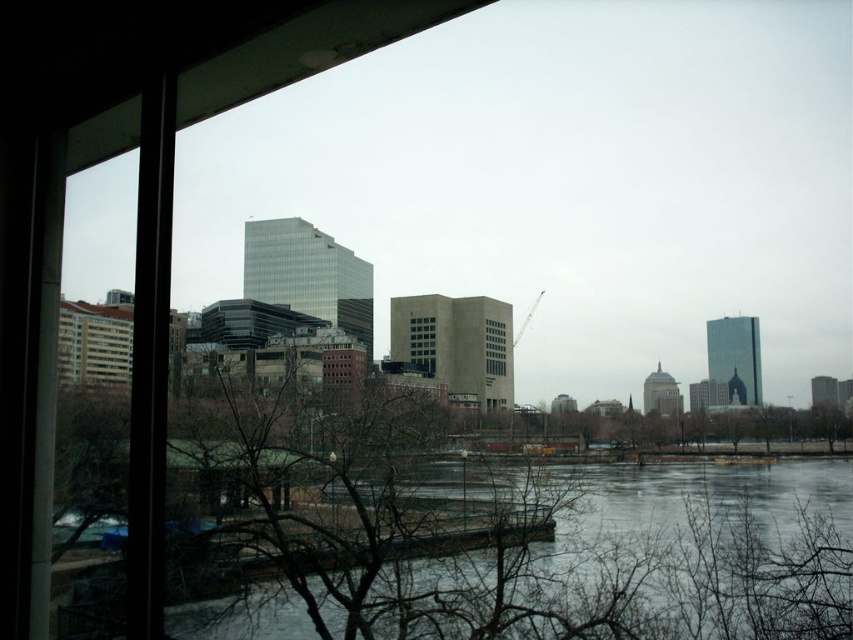
You are standing inside the building and looking through the window. You notice two glass buildings at the center of the view. Which one is closer to you, the matte glass building at center or the clear glass building at center?

The matte glass building at center is closer to you because it is in front of the clear glass building at center.